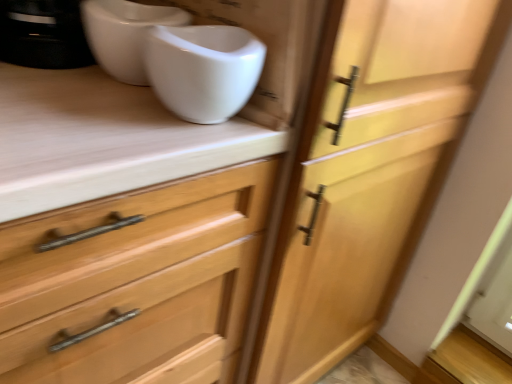
Locate an element on the screen. The width and height of the screenshot is (512, 384). white glossy toilet bowl at upper center is located at coordinates tap(125, 34).

Describe the element at coordinates (125, 34) in the screenshot. The width and height of the screenshot is (512, 384). I see `white glossy toilet bowl at upper center` at that location.

In order to face white glossy toilet bowl at upper center, should I rotate leftwards or rightwards?

Turn left approximately 14.944 degrees to face it.

Where is `white glossy toilet bowl at upper center`? This screenshot has width=512, height=384. white glossy toilet bowl at upper center is located at coordinates pyautogui.click(x=125, y=34).